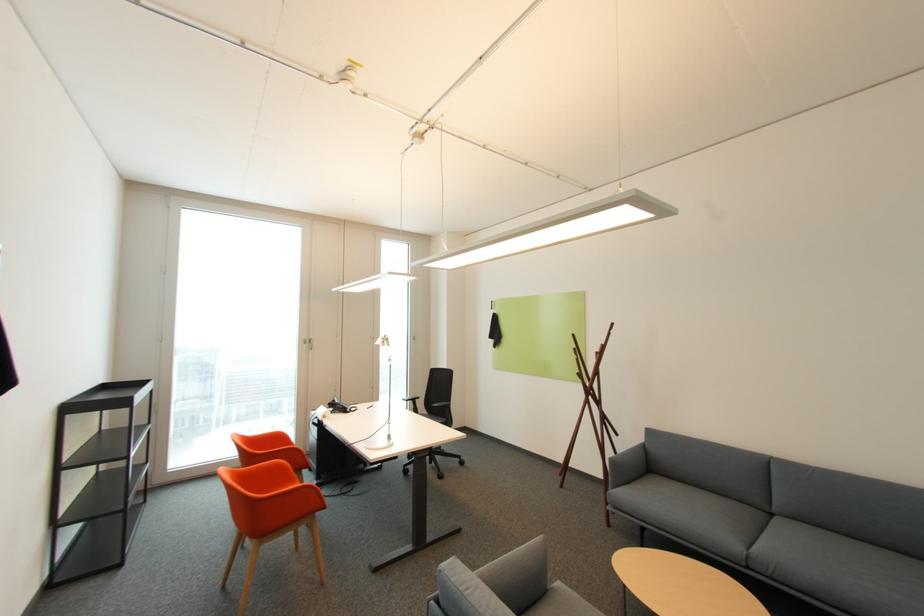
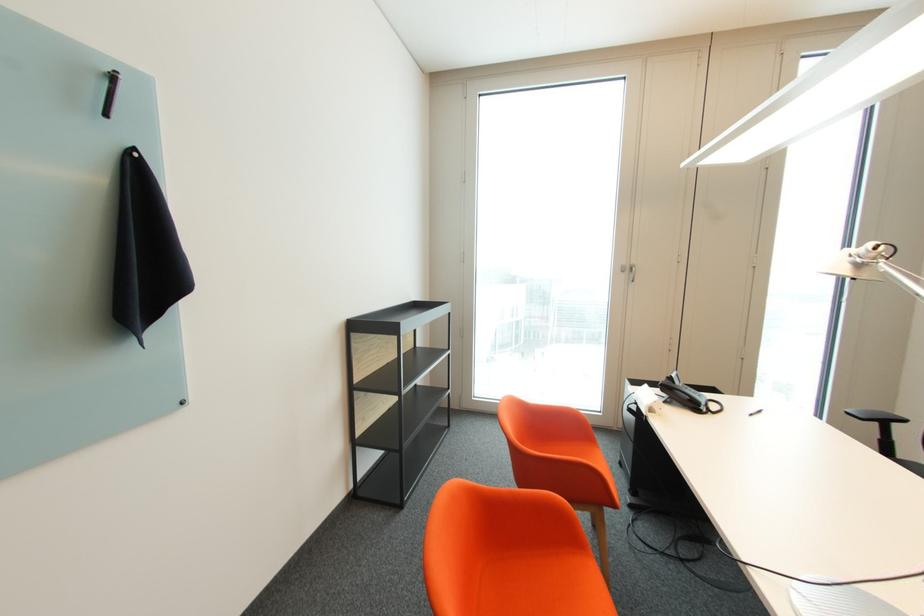
Where in the second image is the point corresponding to [337,410] from the first image?

(673, 397)